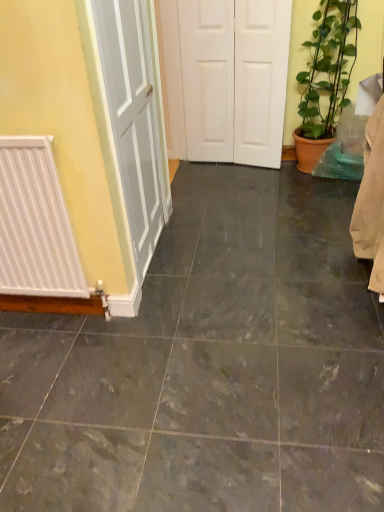
Question: Can you confirm if marble tile at center is shorter than green leafy plant at right?

Choices:
 (A) yes
 (B) no

Answer: (A)

Question: Is marble tile at center not within green leafy plant at right?

Choices:
 (A) no
 (B) yes

Answer: (B)

Question: Is marble tile at center behind green leafy plant at right?

Choices:
 (A) yes
 (B) no

Answer: (B)

Question: Is marble tile at center in contact with green leafy plant at right?

Choices:
 (A) yes
 (B) no

Answer: (B)

Question: Considering the relative sizes of marble tile at center and green leafy plant at right in the image provided, is marble tile at center thinner than green leafy plant at right?

Choices:
 (A) yes
 (B) no

Answer: (B)

Question: In terms of width, does white matte door at center look wider or thinner when compared to white matte radiator at left?

Choices:
 (A) wide
 (B) thin

Answer: (A)

Question: In terms of height, does white matte door at center look taller or shorter compared to white matte radiator at left?

Choices:
 (A) short
 (B) tall

Answer: (B)

Question: From the image's perspective, is white matte door at center positioned above or below white matte radiator at left?

Choices:
 (A) below
 (B) above

Answer: (B)

Question: From a real-world perspective, relative to white matte radiator at left, is white matte door at center vertically above or below?

Choices:
 (A) below
 (B) above

Answer: (B)

Question: From a real-world perspective, is white matte door at center physically located above or below green leafy plant at right?

Choices:
 (A) below
 (B) above

Answer: (B)

Question: In the image, is white matte door at center on the left side or the right side of green leafy plant at right?

Choices:
 (A) right
 (B) left

Answer: (B)

Question: Is white matte door at center wider or thinner than green leafy plant at right?

Choices:
 (A) thin
 (B) wide

Answer: (A)

Question: Is point (230, 109) closer or farther from the camera than point (342, 65)?

Choices:
 (A) closer
 (B) farther

Answer: (B)

Question: Is marble tile at center wider or thinner than white matte door at center?

Choices:
 (A) wide
 (B) thin

Answer: (A)

Question: In terms of size, does marble tile at center appear bigger or smaller than white matte door at center?

Choices:
 (A) big
 (B) small

Answer: (A)